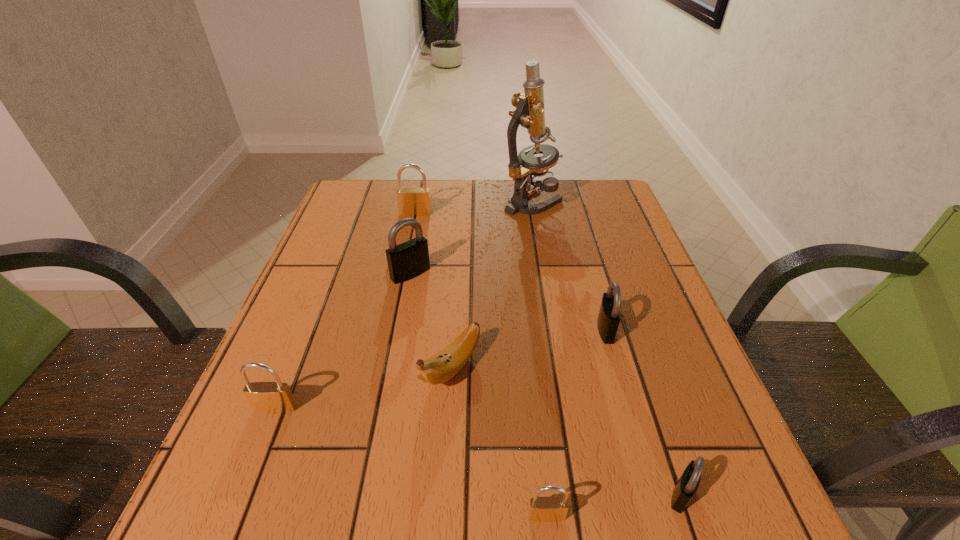
Image resolution: width=960 pixels, height=540 pixels. I want to click on free space that is in between the fourth object from left to right and the seventh object from left to right, so click(x=528, y=349).

You are a GUI agent. You are given a task and a screenshot of the screen. Output one action in this format:
    pyautogui.click(x=<x>, y=<y>)
    Task: Click on the object that is the closest one to the third farthest object
    This screenshot has width=960, height=540.
    Given the screenshot: What is the action you would take?
    pyautogui.click(x=441, y=367)

Point out which object is positioned as the fourth nearest to the fourth padlock from left to right. Please provide its 2D coordinates. Your answer should be formatted as a tuple, i.e. [(x, y)], where the tuple contains the x and y coordinates of a point satisfying the conditions above.

[(265, 397)]

Locate which padlock is the fifth closest to the microscope. Please provide its 2D coordinates. Your answer should be formatted as a tuple, i.e. [(x, y)], where the tuple contains the x and y coordinates of a point satisfying the conditions above.

[(686, 487)]

Point out which padlock is positioned as the third nearest to the rightmost brass padlock. Please provide its 2D coordinates. Your answer should be formatted as a tuple, i.e. [(x, y)], where the tuple contains the x and y coordinates of a point satisfying the conditions above.

[(265, 397)]

I want to click on brass padlock object that ranks as the second closest to the farthest black padlock, so click(265, 397).

This screenshot has height=540, width=960. In order to click on the closest brass padlock relative to the farthest black padlock in this screenshot , I will do `click(411, 201)`.

The width and height of the screenshot is (960, 540). I want to click on the second closest black padlock relative to the biggest black padlock, so click(686, 487).

In order to click on black padlock that is the second nearest to the second brass padlock from left to right in this screenshot , I will do `click(609, 317)`.

Find the location of a particular element. The width and height of the screenshot is (960, 540). vacant space that satisfies the following two spatial constraints: 1. on the front-facing side of the second brass padlock from left to right; 2. on the left side of the banana is located at coordinates (384, 368).